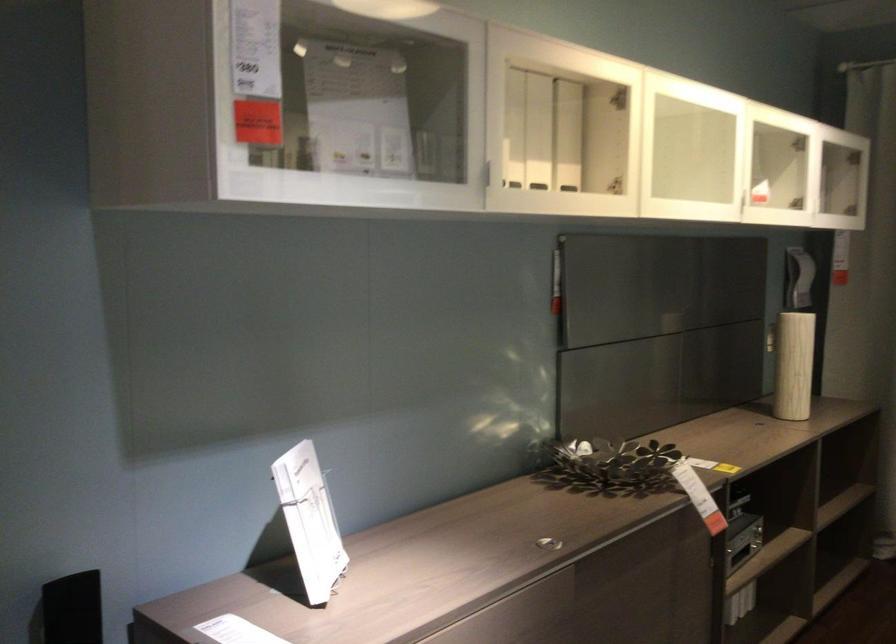
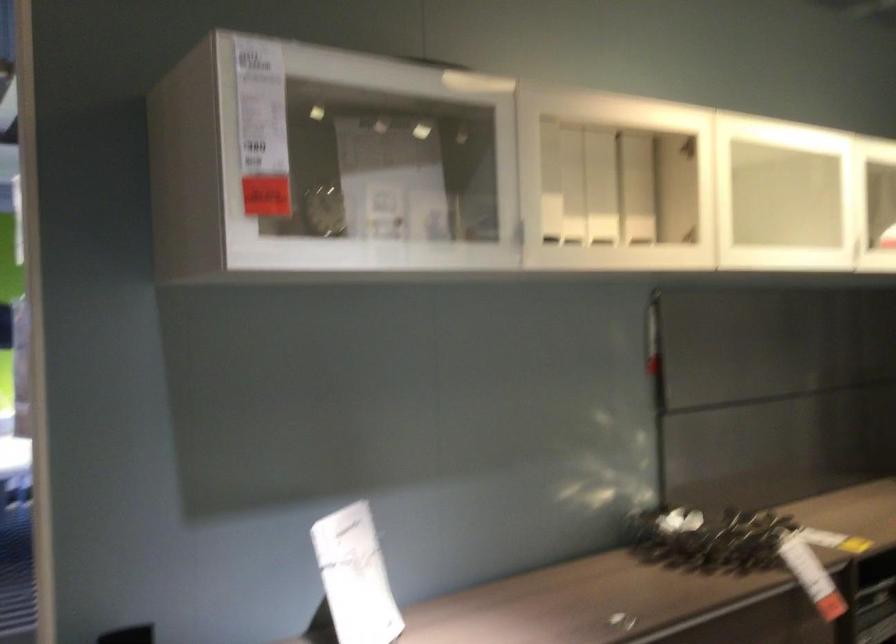
Where in the second image is the point corresponding to pixel 319 515 from the first image?

(355, 576)